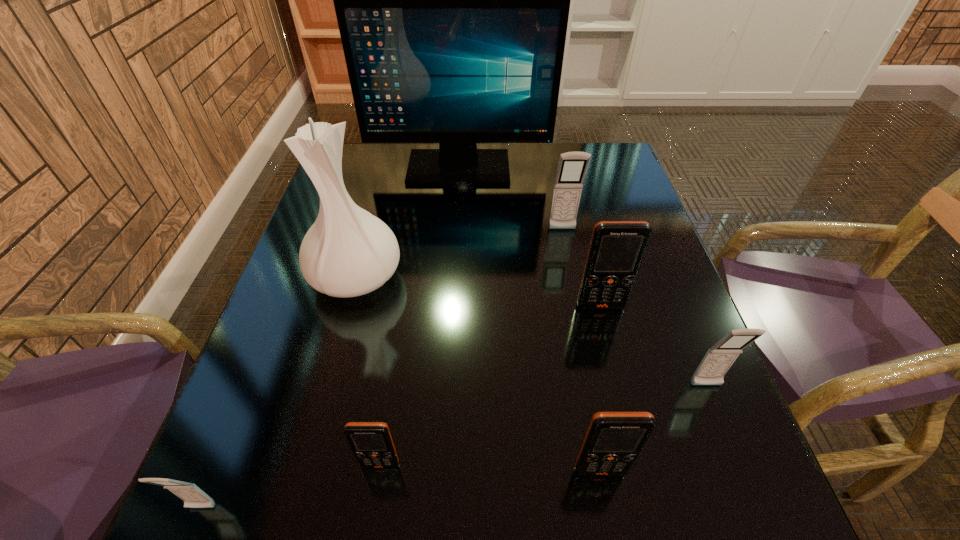
Where is `vacant region between the nearest cellular telephone and the farthest object`? Image resolution: width=960 pixels, height=540 pixels. vacant region between the nearest cellular telephone and the farthest object is located at coordinates tap(330, 338).

Find the location of a particular element. The height and width of the screenshot is (540, 960). vacant area that lies between the black monitor and the rightmost object is located at coordinates (583, 277).

Find the location of a particular element. The height and width of the screenshot is (540, 960). unoccupied area between the fifth cellular telephone from right to left and the farthest cellular telephone is located at coordinates (471, 347).

Where is `vacant area that lies between the farthest orange cellular telephone and the tallest object`? This screenshot has height=540, width=960. vacant area that lies between the farthest orange cellular telephone and the tallest object is located at coordinates (530, 237).

Locate an element on the screen. Image resolution: width=960 pixels, height=540 pixels. vacant area between the vase and the second biggest orange cellular telephone is located at coordinates (478, 374).

Choose which object is the third nearest neighbor to the leftmost orange cellular telephone. Please provide its 2D coordinates. Your answer should be formatted as a tuple, i.e. [(x, y)], where the tuple contains the x and y coordinates of a point satisfying the conditions above.

[(348, 252)]

Locate which object is the seventh closest to the vase. Please provide its 2D coordinates. Your answer should be formatted as a tuple, i.e. [(x, y)], where the tuple contains the x and y coordinates of a point satisfying the conditions above.

[(719, 358)]

Identify which cellular telephone is the second closest to the nearest gray cellular telephone. Please provide its 2D coordinates. Your answer should be formatted as a tuple, i.e. [(x, y)], where the tuple contains the x and y coordinates of a point satisfying the conditions above.

[(613, 441)]

Select which cellular telephone appears as the fourth closest to the second biggest orange cellular telephone. Please provide its 2D coordinates. Your answer should be formatted as a tuple, i.e. [(x, y)], where the tuple contains the x and y coordinates of a point satisfying the conditions above.

[(193, 497)]

Select which gray cellular telephone appears as the closest to the smallest orange cellular telephone. Please provide its 2D coordinates. Your answer should be formatted as a tuple, i.e. [(x, y)], where the tuple contains the x and y coordinates of a point satisfying the conditions above.

[(193, 497)]